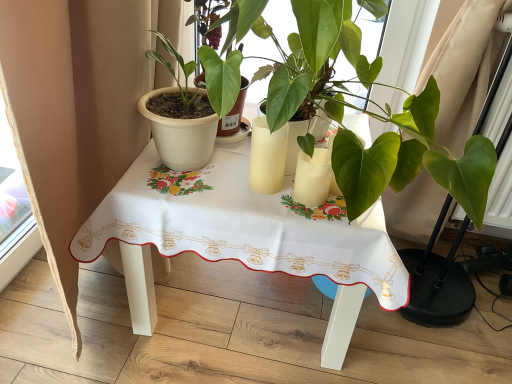
Locate an element on the screen. The height and width of the screenshot is (384, 512). free point to the right of matte white pot at left, which ranks as the second houseplant in right-to-left order is located at coordinates (242, 168).